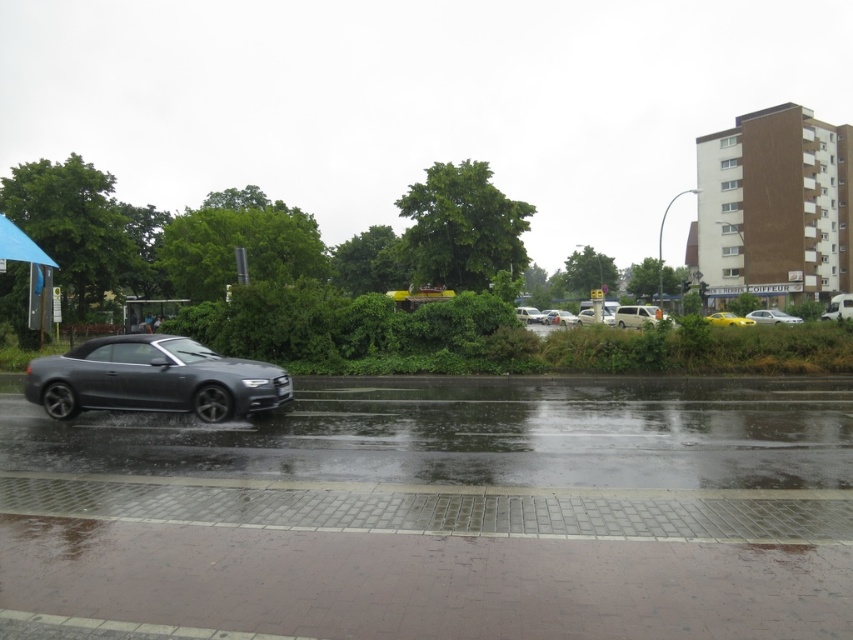
Question: Which object is positioned closest to the white matte van at center?

Choices:
 (A) matte silver car at center
 (B) white matte car at center

Answer: (A)

Question: Which point is closer to the camera?

Choices:
 (A) (842, 304)
 (B) (749, 321)

Answer: (B)

Question: Can you confirm if white matte van at center-right is positioned to the right of yellow matte car at center?

Choices:
 (A) yes
 (B) no

Answer: (B)

Question: Does white matte van at right appear under matte silver car at center?

Choices:
 (A) no
 (B) yes

Answer: (A)

Question: Which of the following is the farthest from the observer?

Choices:
 (A) click(799, 317)
 (B) click(718, 321)

Answer: (A)

Question: Does glossy asphalt road at lower center appear on the right side of white matte van at center?

Choices:
 (A) yes
 (B) no

Answer: (B)